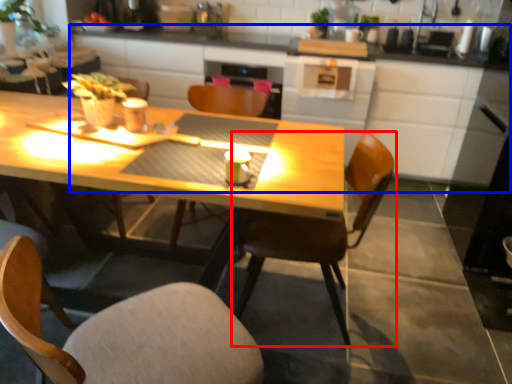
Question: Which object is further to the camera taking this photo, chair (highlighted by a red box) or counter (highlighted by a blue box)?

Choices:
 (A) chair
 (B) counter

Answer: (B)